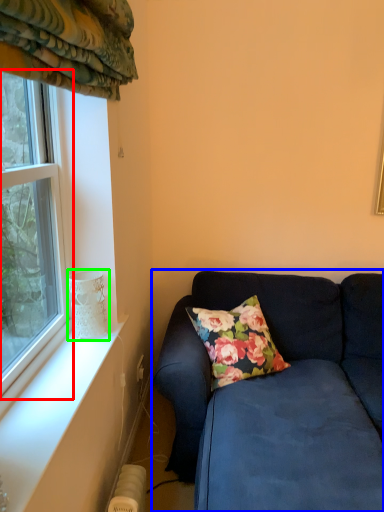
Question: Which object is the closest to the window (highlighted by a red box)? Choose among these: studio couch (highlighted by a blue box) or glass vase (highlighted by a green box).

Choices:
 (A) studio couch
 (B) glass vase

Answer: (B)